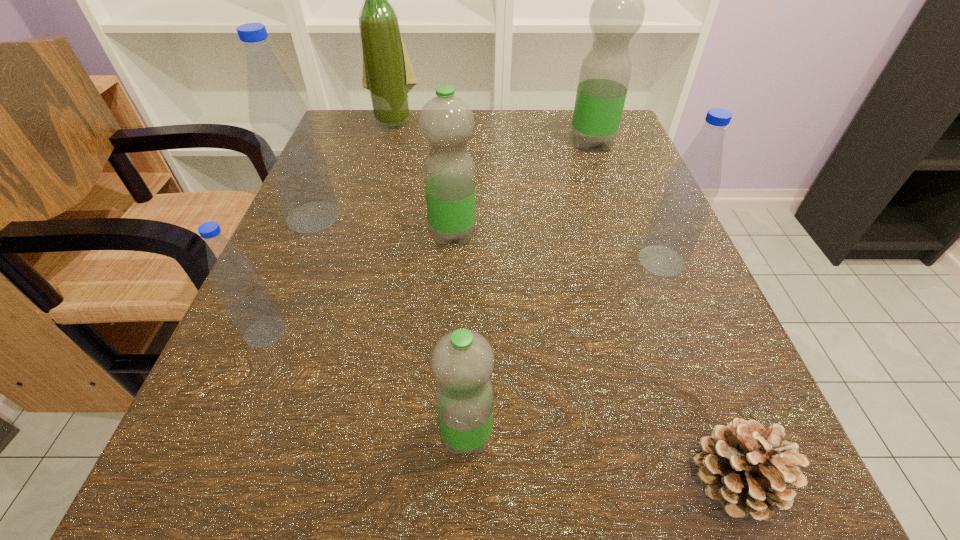
Image resolution: width=960 pixels, height=540 pixels. Find the location of `wine bottle`. wine bottle is located at coordinates (388, 74).

At what (x,y) coordinates should I click in order to perform the action: click on the farthest green water bottle. Please return your answer as a coordinate pair (x, y). Looking at the image, I should click on (617, 13).

Where is `the rightmost green water bottle`? the rightmost green water bottle is located at coordinates (617, 13).

Find the location of a particular element. The height and width of the screenshot is (540, 960). the farthest blue water bottle is located at coordinates (279, 118).

The height and width of the screenshot is (540, 960). Identify the location of the second farthest green water bottle. (446, 122).

Locate an element on the screen. Image resolution: width=960 pixels, height=540 pixels. the second smallest blue water bottle is located at coordinates (693, 183).

Locate an element on the screen. the second nearest blue water bottle is located at coordinates (693, 183).

Image resolution: width=960 pixels, height=540 pixels. I want to click on the smallest blue water bottle, so click(249, 303).

Image resolution: width=960 pixels, height=540 pixels. Identify the location of the second nearest water bottle. (249, 303).

I want to click on the smallest green water bottle, so click(462, 361).